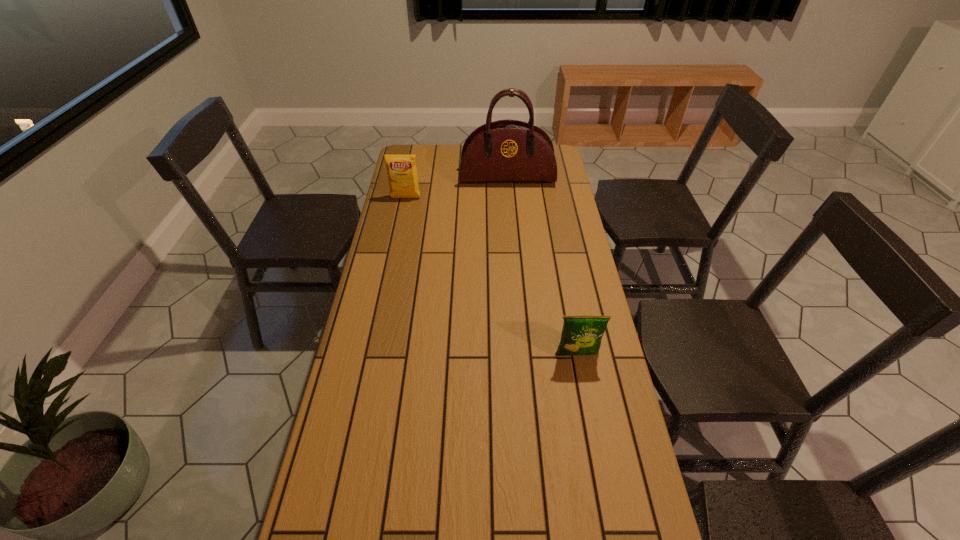
Choose which object is the second nearest neighbor to the nearest object. Please provide its 2D coordinates. Your answer should be formatted as a tuple, i.e. [(x, y)], where the tuple contains the x and y coordinates of a point satisfying the conditions above.

[(401, 169)]

Identify which object is the second closest to the nearest object. Please provide its 2D coordinates. Your answer should be formatted as a tuple, i.e. [(x, y)], where the tuple contains the x and y coordinates of a point satisfying the conditions above.

[(401, 169)]